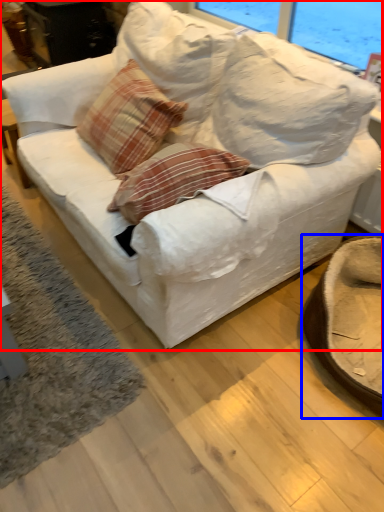
Question: Which point is closer to the camera, studio couch (highlighted by a red box) or swivel chair (highlighted by a blue box)?

Choices:
 (A) studio couch
 (B) swivel chair

Answer: (A)